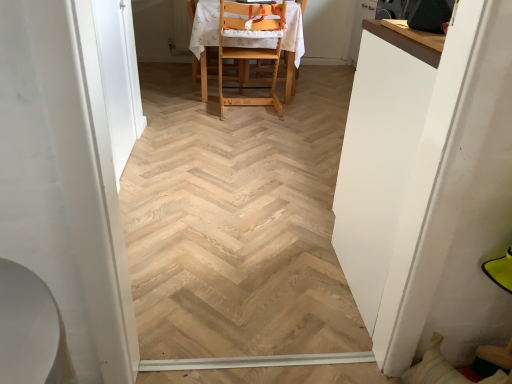
Where is `vacant space in between light wood highchair at center and white glossy screen door at left, the second screen door positioned from the back`? vacant space in between light wood highchair at center and white glossy screen door at left, the second screen door positioned from the back is located at coordinates (195, 144).